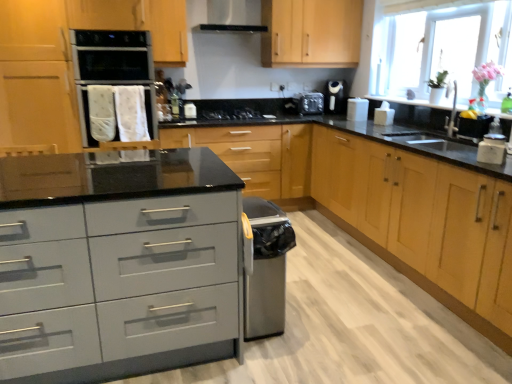
Question: From a real-world perspective, does satin grey drawers at center, the second cabinetry when ordered from right to left, sit lower than satin black exhaust hood at upper center?

Choices:
 (A) yes
 (B) no

Answer: (A)

Question: Could you tell me if satin grey drawers at center, positioned as the 2th cabinetry in left-to-right order, is turned towards satin black exhaust hood at upper center?

Choices:
 (A) no
 (B) yes

Answer: (A)

Question: From the image's perspective, is satin grey drawers at center, the second cabinetry when ordered from right to left, below satin black exhaust hood at upper center?

Choices:
 (A) yes
 (B) no

Answer: (A)

Question: Does satin grey drawers at center, positioned as the 2th cabinetry in left-to-right order, appear on the left side of satin black exhaust hood at upper center?

Choices:
 (A) no
 (B) yes

Answer: (A)

Question: Considering the relative sizes of satin grey drawers at center, the second cabinetry when ordered from right to left, and satin black exhaust hood at upper center in the image provided, is satin grey drawers at center, the second cabinetry when ordered from right to left, taller than satin black exhaust hood at upper center?

Choices:
 (A) no
 (B) yes

Answer: (B)

Question: Is satin black exhaust hood at upper center inside satin grey drawers at center, the second cabinetry when ordered from right to left?

Choices:
 (A) yes
 (B) no

Answer: (B)

Question: Is black plastic toaster at upper center, placed as the first appliance when sorted from left to right, positioned far away from white matte sugar container at right?

Choices:
 (A) no
 (B) yes

Answer: (B)

Question: Is black plastic toaster at upper center, placed as the third appliance when sorted from right to left, further to the viewer compared to white matte sugar container at right?

Choices:
 (A) yes
 (B) no

Answer: (A)

Question: Is black plastic toaster at upper center, which is counted as the third appliance, starting from the front, positioned in front of white matte sugar container at right?

Choices:
 (A) no
 (B) yes

Answer: (A)

Question: Does black plastic toaster at upper center, the 1th appliance in the back-to-front sequence, have a lesser height compared to white matte sugar container at right?

Choices:
 (A) no
 (B) yes

Answer: (A)

Question: Does black plastic toaster at upper center, placed as the first appliance when sorted from left to right, touch white matte sugar container at right?

Choices:
 (A) yes
 (B) no

Answer: (B)

Question: Is black plastic toaster at upper center, which is counted as the third appliance, starting from the front, at the right side of white matte sugar container at right?

Choices:
 (A) yes
 (B) no

Answer: (B)

Question: From the image's perspective, is white glossy toaster at upper right, positioned as the second appliance in back-to-front order, located above black plastic toaster at upper center, which is counted as the third appliance, starting from the front?

Choices:
 (A) yes
 (B) no

Answer: (B)